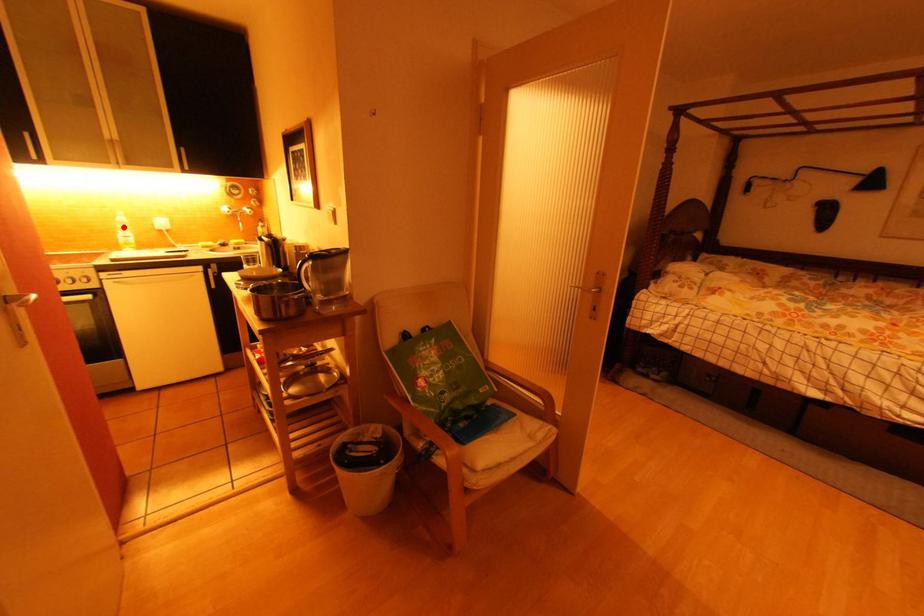
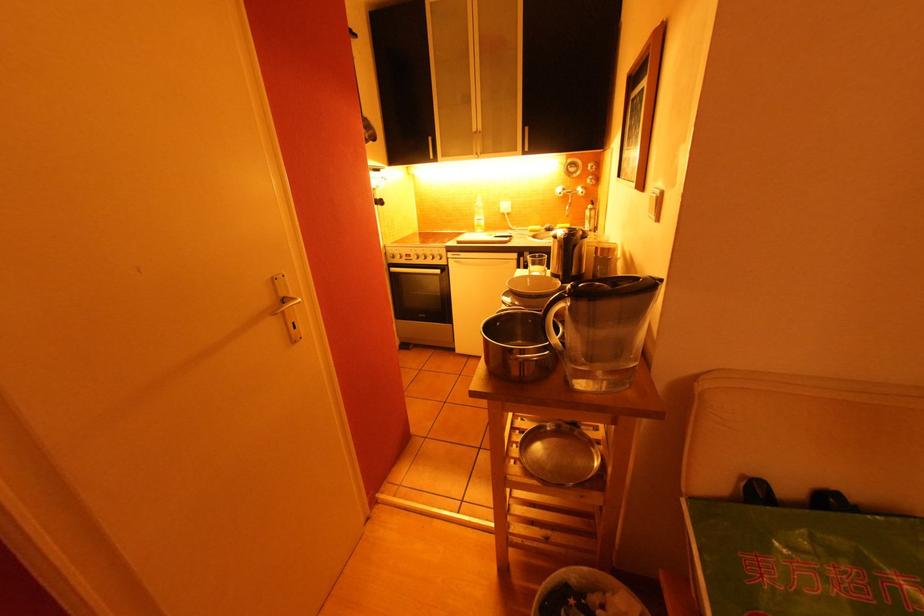
In the second image, find the point that corresponds to the highlighted location in the first image.

(481, 211)